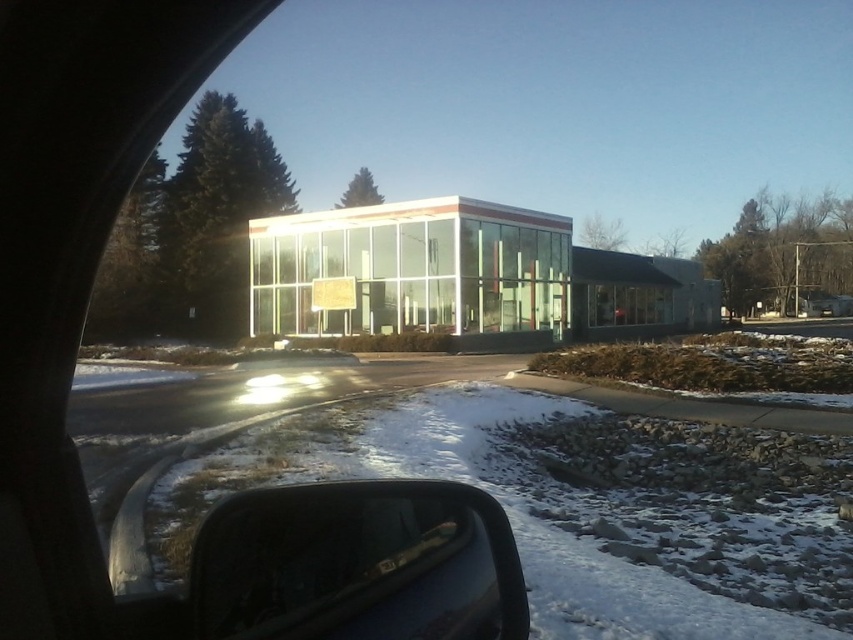
Question: Which of the following is the farthest from the observer?

Choices:
 (A) (352, 563)
 (B) (537, 401)

Answer: (B)

Question: Observing the image, what is the correct spatial positioning of white powdery snow at lower left in reference to transparent glass side mirror at lower left?

Choices:
 (A) below
 (B) above

Answer: (A)

Question: Can you confirm if white powdery snow at lower left is bigger than transparent glass side mirror at lower left?

Choices:
 (A) yes
 (B) no

Answer: (B)

Question: Observing the image, what is the correct spatial positioning of white powdery snow at lower left in reference to transparent glass side mirror at lower left?

Choices:
 (A) below
 (B) above

Answer: (A)

Question: Among these objects, which one is nearest to the camera?

Choices:
 (A) transparent glass side mirror at lower left
 (B) white powdery snow at lower left

Answer: (A)